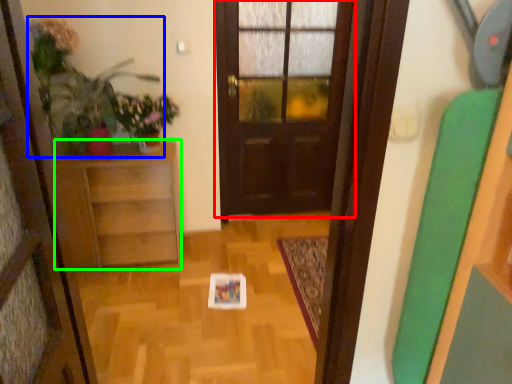
Question: Considering the real-world distances, which object is closest to door (highlighted by a red box)? plant (highlighted by a blue box) or furniture (highlighted by a green box).

Choices:
 (A) plant
 (B) furniture

Answer: (B)